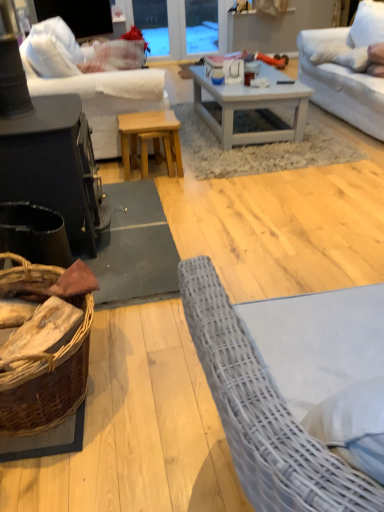
Question: Is white wooden coffee table at center further to camera compared to transparent glass door at upper center?

Choices:
 (A) yes
 (B) no

Answer: (B)

Question: Is white wooden coffee table at center facing away from transparent glass door at upper center?

Choices:
 (A) yes
 (B) no

Answer: (A)

Question: Does white wooden coffee table at center contain transparent glass door at upper center?

Choices:
 (A) no
 (B) yes

Answer: (A)

Question: Does white wooden coffee table at center appear on the left side of transparent glass door at upper center?

Choices:
 (A) no
 (B) yes

Answer: (A)

Question: Can you confirm if white wooden coffee table at center is wider than transparent glass door at upper center?

Choices:
 (A) yes
 (B) no

Answer: (A)

Question: Can you confirm if white wooden coffee table at center is thinner than transparent glass door at upper center?

Choices:
 (A) yes
 (B) no

Answer: (B)

Question: Can you confirm if black matte wood table at left, the first table viewed from the front, is taller than natural wood stool at center, the second table from the front?

Choices:
 (A) yes
 (B) no

Answer: (A)

Question: Can natural wood stool at center, positioned as the 1th table in back-to-front order, be found inside black matte wood table at left, the first table viewed from the front?

Choices:
 (A) no
 (B) yes

Answer: (A)

Question: Is black matte wood table at left, the first table viewed from the front, bigger than natural wood stool at center, positioned as the 1th table in back-to-front order?

Choices:
 (A) no
 (B) yes

Answer: (B)

Question: Considering the relative sizes of black matte wood table at left, the first table viewed from the front, and natural wood stool at center, positioned as the 1th table in back-to-front order, in the image provided, is black matte wood table at left, the first table viewed from the front, smaller than natural wood stool at center, positioned as the 1th table in back-to-front order,?

Choices:
 (A) no
 (B) yes

Answer: (A)

Question: Is black matte wood table at left, which appears as the second table when viewed from the back, next to natural wood stool at center, positioned as the 1th table in back-to-front order?

Choices:
 (A) no
 (B) yes

Answer: (A)

Question: Considering the relative positions of black matte wood table at left, which appears as the second table when viewed from the back, and natural wood stool at center, positioned as the 1th table in back-to-front order, in the image provided, is black matte wood table at left, which appears as the second table when viewed from the back, to the left of natural wood stool at center, positioned as the 1th table in back-to-front order, from the viewer's perspective?

Choices:
 (A) yes
 (B) no

Answer: (A)

Question: Is white fabric couch at upper right, the first studio couch positioned from the right, wider than black matte wood table at left, the first table viewed from the front?

Choices:
 (A) yes
 (B) no

Answer: (A)